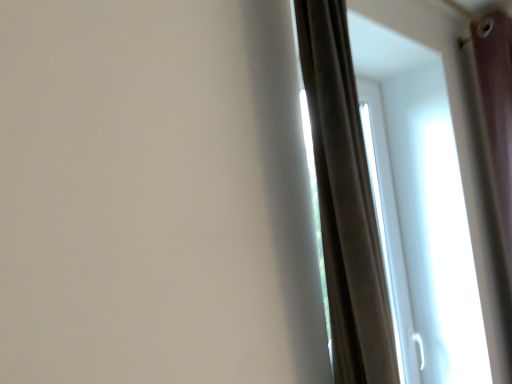
The width and height of the screenshot is (512, 384). What do you see at coordinates (420, 206) in the screenshot?
I see `brown velvet curtain at right` at bounding box center [420, 206].

The image size is (512, 384). I want to click on brown velvet curtain at right, so click(420, 206).

Identify the location of brown velvet curtain at right. (420, 206).